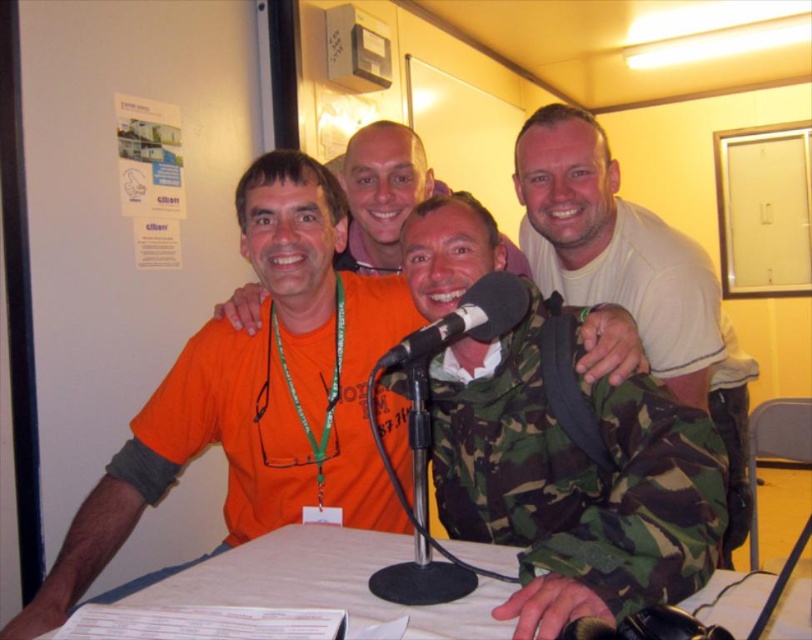
You are a guest speaker at the event and need to place your black matte microphone at center on the table. However, there is a camouflage fabric backpack at right in the way. Can you move the backpack to the side to make space?

The camouflage fabric backpack at right is to the right of the black matte microphone at center, so moving the backpack to the right side would free up space for the microphone.

You are a sound technician adjusting the microphone stand. You need to ensure that the black matte microphone at center is positioned so that it is closer to the viewer than the camouflage fabric shirt at center. Is the current setup correct?

The camouflage fabric shirt at center is currently closer to the viewer than the black matte microphone at center, so the current setup is incorrect. The microphone should be moved forward to be closer to the viewer than the shirt.

You are a guest on a radio show and need to place your notes on the table so they are visible to the host. The host is seated across from you and the white paper at center and black matte microphone at center are on the table. Where should you place your notes relative to the microphone to ensure the host can see them?

Answer: Place your notes on the left side of the black matte microphone at center, as the white paper at center is already positioned there and serves as a good reference point for visibility.